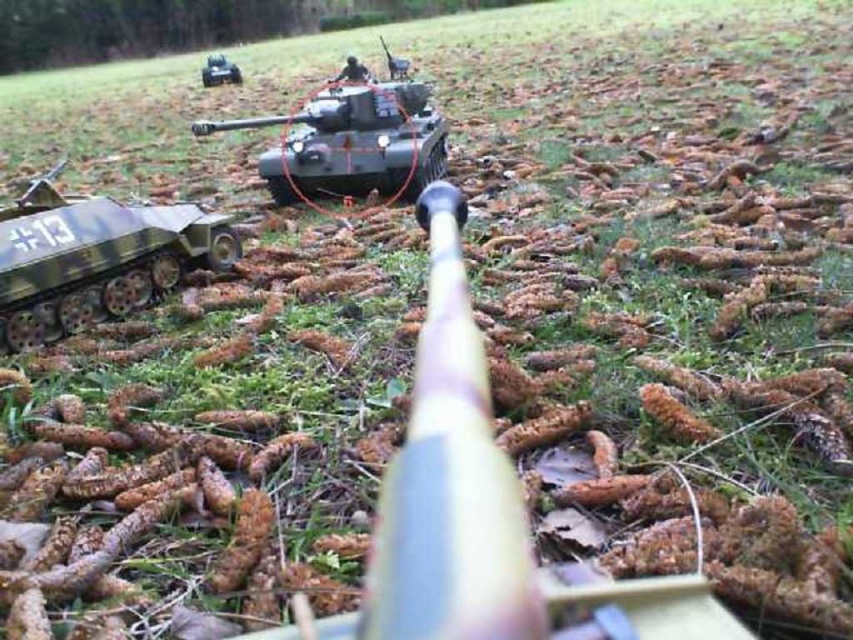
Does camouflage painted tank at left have a smaller size compared to metallic gray tank at upper center?

Yes.

Find the location of `camouflage painted tank at left`. camouflage painted tank at left is located at coordinates (96, 259).

Locate an element on the screen. Image resolution: width=853 pixels, height=640 pixels. camouflage painted tank at left is located at coordinates (96, 259).

Who is positioned more to the right, green matte tank at center or metallic gray tank at upper center?

green matte tank at center

Which of these two, green matte tank at center or metallic gray tank at upper center, stands shorter?

Standing shorter between the two is green matte tank at center.

Locate an element on the screen. green matte tank at center is located at coordinates (352, 140).

Locate an element on the screen. green matte tank at center is located at coordinates (352, 140).

Is point (28, 259) positioned before point (355, 177)?

Yes, it is in front of point (355, 177).

Which is behind, point (152, 248) or point (325, 115)?

Positioned behind is point (325, 115).

Between point (123, 266) and point (276, 177), which one is positioned in front?

Point (123, 266)

Image resolution: width=853 pixels, height=640 pixels. I want to click on camouflage painted tank at left, so click(x=96, y=259).